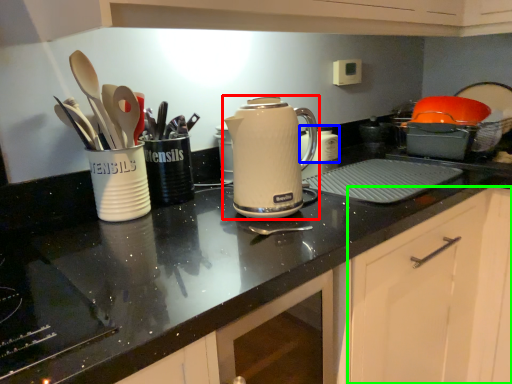
Question: Based on their relative distances, which object is nearer to kettle (highlighted by a red box)? Choose from appliance (highlighted by a blue box) and cabinetry (highlighted by a green box).

Choices:
 (A) appliance
 (B) cabinetry

Answer: (B)